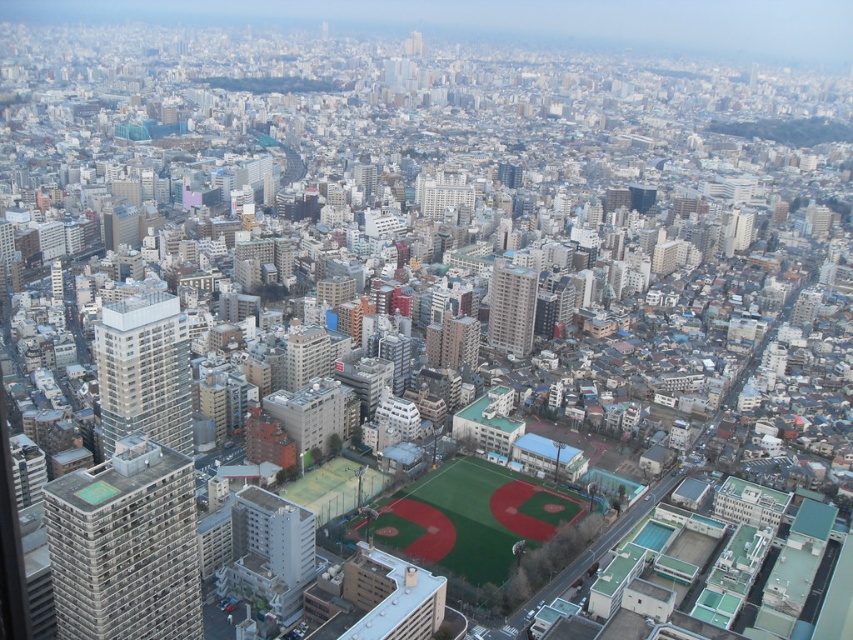
Question: Does green artificial turf baseball field at center have a smaller size compared to gray concrete building at center?

Choices:
 (A) yes
 (B) no

Answer: (B)

Question: Does gray concrete building at lower left appear on the right side of matte gray building at center?

Choices:
 (A) yes
 (B) no

Answer: (B)

Question: Which point is closer to the camera?

Choices:
 (A) matte gray building at center
 (B) gray concrete building at lower left
 (C) beige concrete building at center-left

Answer: (B)

Question: Estimate the real-world distances between objects in this image. Which object is farther from the gray concrete building at lower left?

Choices:
 (A) beige concrete building at center-left
 (B) matte gray building at center

Answer: (B)

Question: Is gray concrete building at lower left further to camera compared to gray concrete building at center?

Choices:
 (A) no
 (B) yes

Answer: (A)

Question: Which point is closer to the camera taking this photo?

Choices:
 (A) (410, 545)
 (B) (288, 349)

Answer: (A)